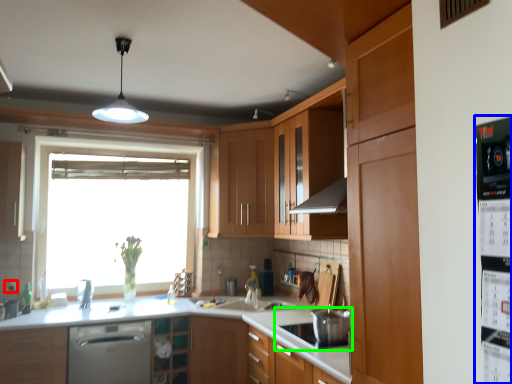
Question: Estimate the real-world distances between objects in this image. Which object is farther from electric outlet (highlighted by a red box), appliance (highlighted by a blue box) or kitchen appliance (highlighted by a green box)?

Choices:
 (A) appliance
 (B) kitchen appliance

Answer: (A)